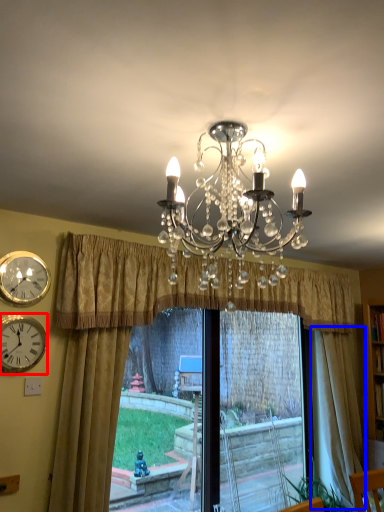
Question: Among these objects, which one is farthest to the camera, wall clock (highlighted by a red box) or curtain (highlighted by a blue box)?

Choices:
 (A) wall clock
 (B) curtain

Answer: (B)